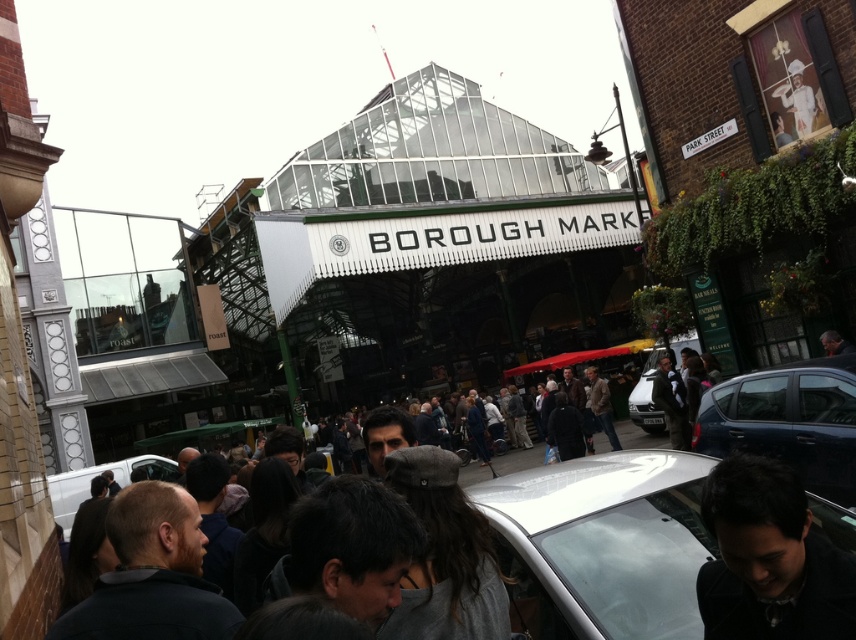
Question: Observing the image, what is the correct spatial positioning of white glossy car at lower center in reference to white matte van at lower left?

Choices:
 (A) left
 (B) right

Answer: (B)

Question: Which object is closer to the camera taking this photo?

Choices:
 (A) silver metallic van at center
 (B) dark blue metallic hatchback at lower right
 (C) white matte van at lower left
 (D) dark brown leather jacket at center

Answer: (B)

Question: Which object is closer to the camera taking this photo?

Choices:
 (A) dark brown leather jacket at center
 (B) dark blue metallic hatchback at lower right
 (C) white glossy car at lower center
 (D) black matte jacket at lower right

Answer: (D)

Question: Which of the following is the farthest from the observer?

Choices:
 (A) dark brown leather jacket at center
 (B) white glossy car at lower center

Answer: (A)

Question: Can you confirm if white matte van at lower left is bigger than silver metallic van at center?

Choices:
 (A) yes
 (B) no

Answer: (A)

Question: Does white glossy car at lower center have a lesser width compared to white matte van at lower left?

Choices:
 (A) yes
 (B) no

Answer: (A)